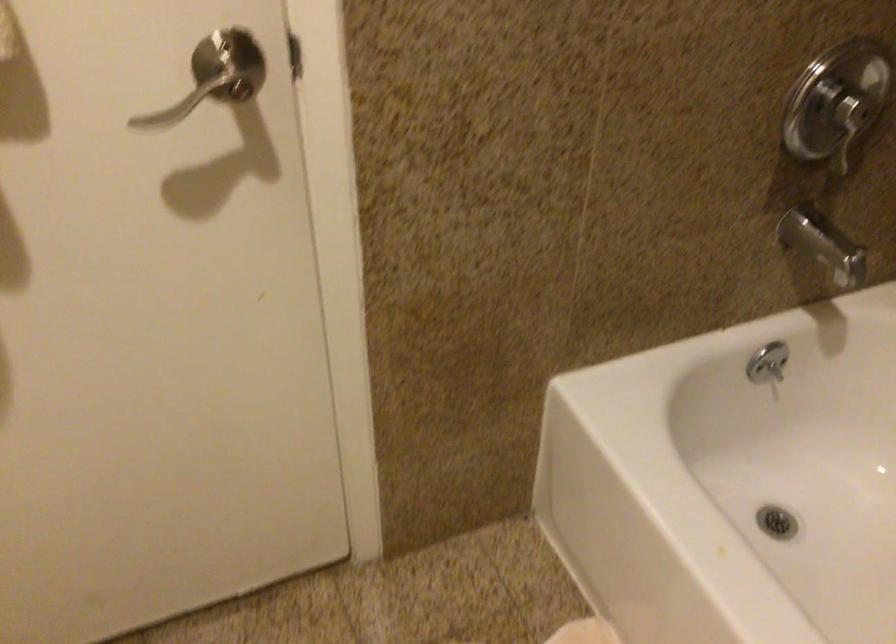
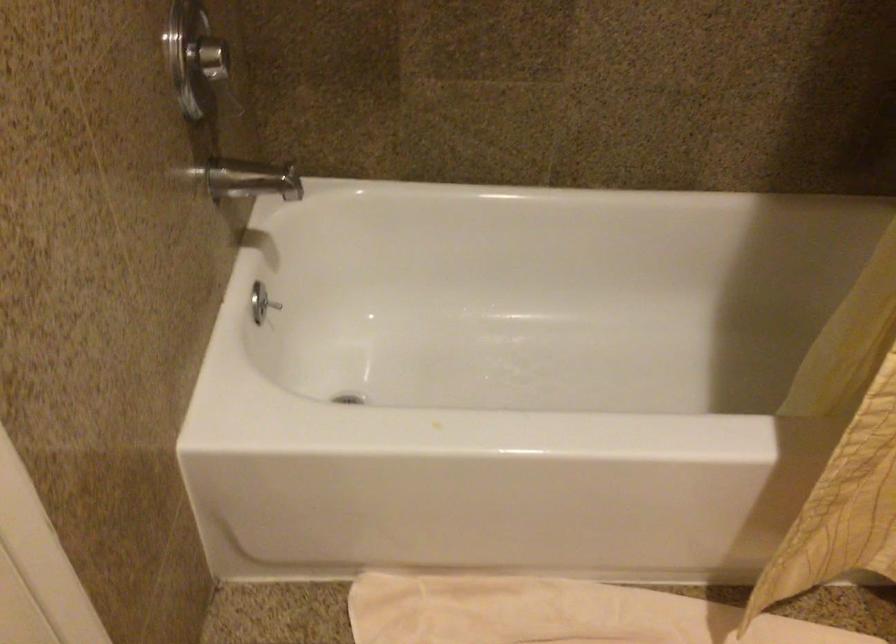
Looking at this image, how did the camera likely rotate?

The camera rotated toward right-down.